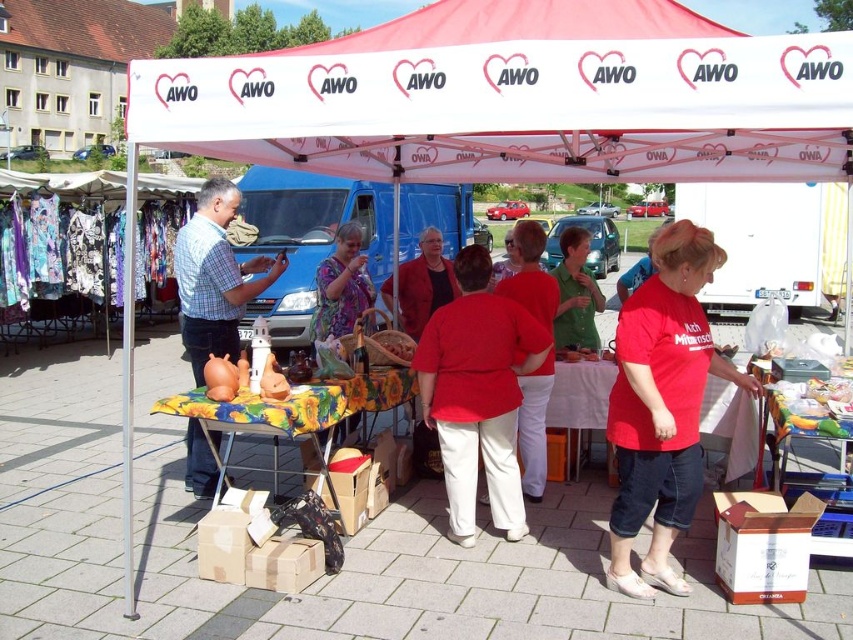
Which is more to the right, matte red shirt at center or green matte shirt at center?

Positioned to the right is green matte shirt at center.

In the scene shown: Who is more forward, (537, 310) or (595, 330)?

Point (537, 310)

Does point (509, 280) come behind point (576, 340)?

No, it is not.

Locate an element on the screen. The image size is (853, 640). matte red shirt at center is located at coordinates (529, 275).

Between matte red shirt at center and matte purple blouse at center, which one has more height?

Standing taller between the two is matte purple blouse at center.

Image resolution: width=853 pixels, height=640 pixels. In order to click on matte red shirt at center in this screenshot , I will do `click(529, 275)`.

Measure the distance between matte red shirt at center and camera.

matte red shirt at center and camera are 4.89 meters apart.

This screenshot has height=640, width=853. I want to click on matte red shirt at center, so click(529, 275).

Can you confirm if white fabric canopy at upper center is smaller than matte red shirt at center?

Correct, white fabric canopy at upper center occupies less space than matte red shirt at center.

Is white fabric canopy at upper center positioned at the back of matte red shirt at center?

Yes, white fabric canopy at upper center is behind matte red shirt at center.

What do you see at coordinates (518, 99) in the screenshot? I see `white fabric canopy at upper center` at bounding box center [518, 99].

At what (x,y) coordinates should I click in order to perform the action: click on white fabric canopy at upper center. Please return your answer as a coordinate pair (x, y). Looking at the image, I should click on click(x=518, y=99).